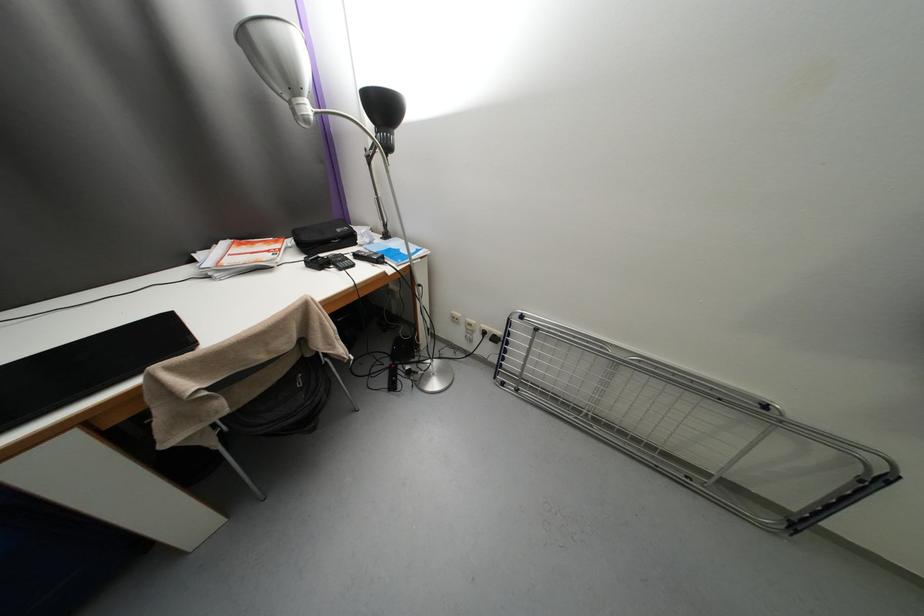
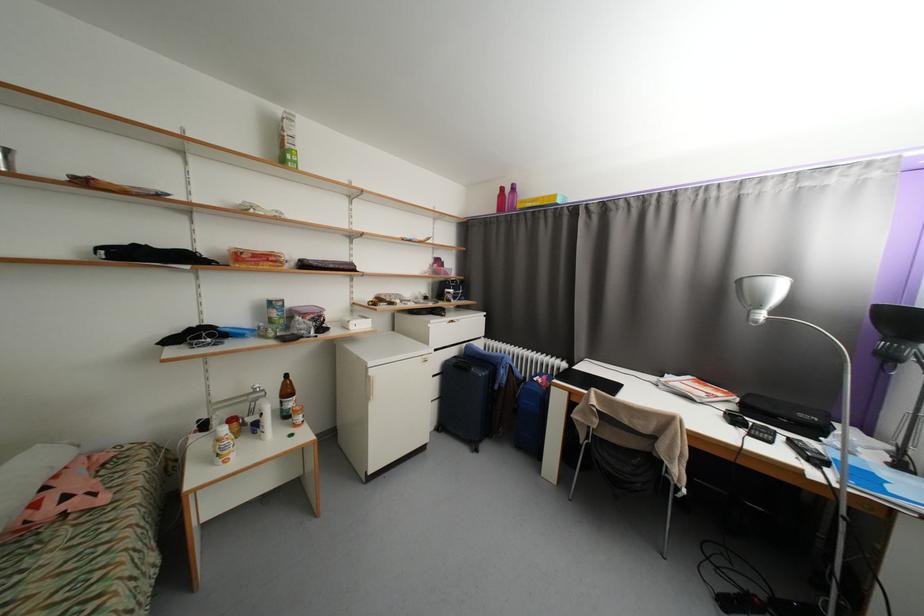
In the second image, find the point that corresponds to (x=312, y=121) in the first image.

(761, 323)